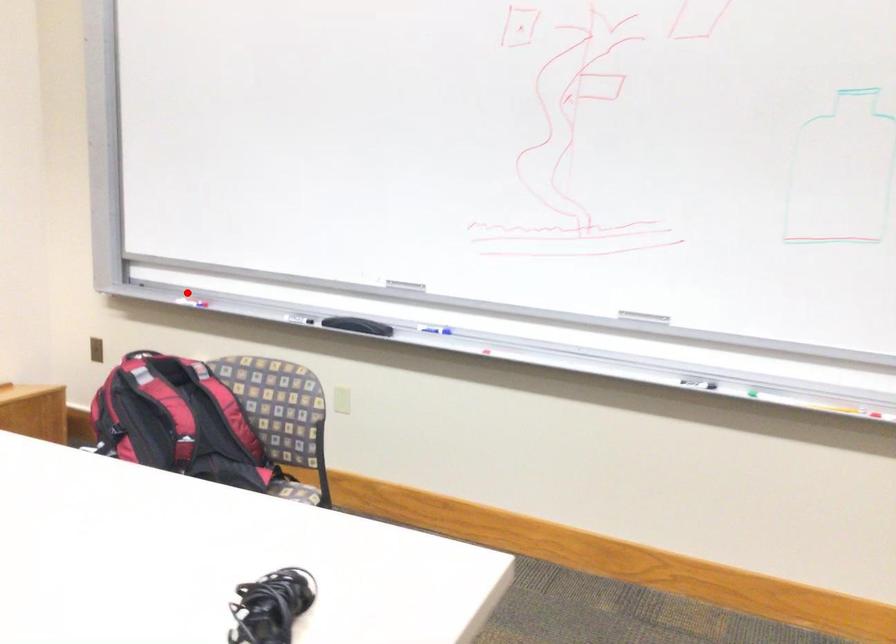
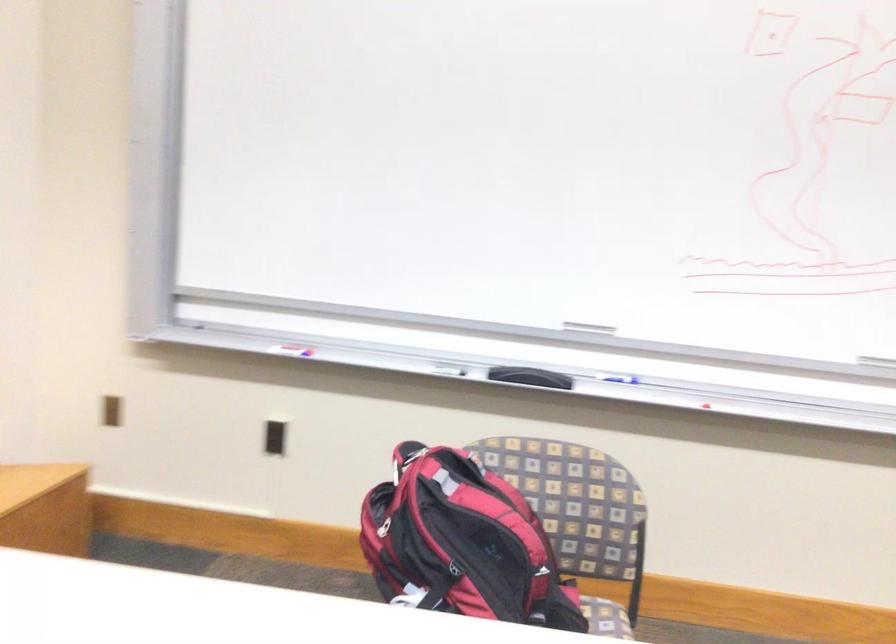
Where in the second image is the point corresponding to the highlighted location from the first image?

(288, 345)